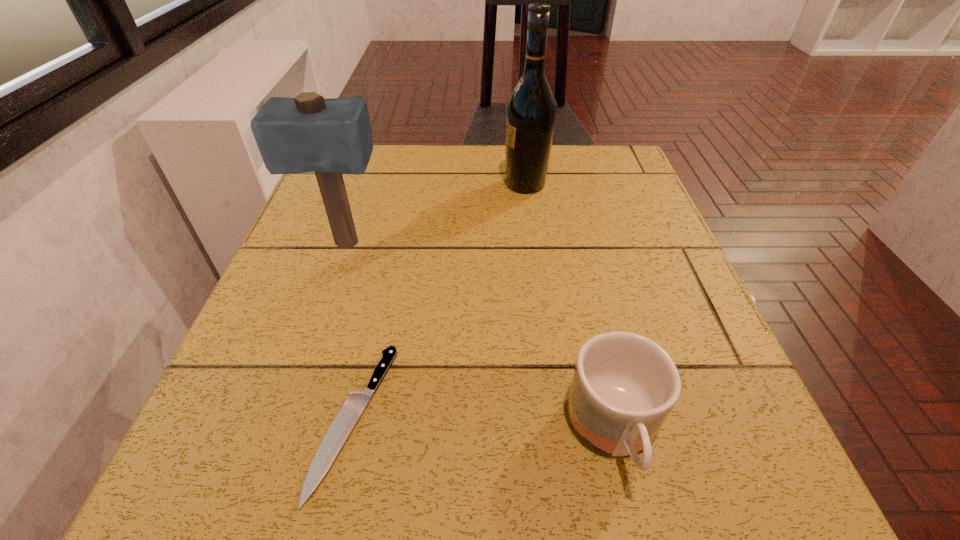
Find the location of a particular element. The height and width of the screenshot is (540, 960). wine bottle is located at coordinates (531, 109).

Locate an element on the screen. The height and width of the screenshot is (540, 960). the tallest object is located at coordinates (531, 109).

Where is `the third nearest object`? This screenshot has height=540, width=960. the third nearest object is located at coordinates (308, 133).

This screenshot has width=960, height=540. In order to click on mallet in this screenshot , I will do `click(308, 133)`.

Find the location of a particular element. mug is located at coordinates (624, 386).

I want to click on steak knife, so click(344, 422).

Where is `vacant space situated 0.210m on the label of the farthest object`? vacant space situated 0.210m on the label of the farthest object is located at coordinates (415, 184).

At what (x,y) coordinates should I click in order to perform the action: click on vacant space located 0.090m on the label of the farthest object. Please return your answer as a coordinate pair (x, y). The height and width of the screenshot is (540, 960). Looking at the image, I should click on (465, 184).

The height and width of the screenshot is (540, 960). Find the location of `free space located 0.310m on the label of the farthest object`. free space located 0.310m on the label of the farthest object is located at coordinates (372, 184).

Locate an element on the screen. vacant space located on the front of the second tallest object is located at coordinates (296, 393).